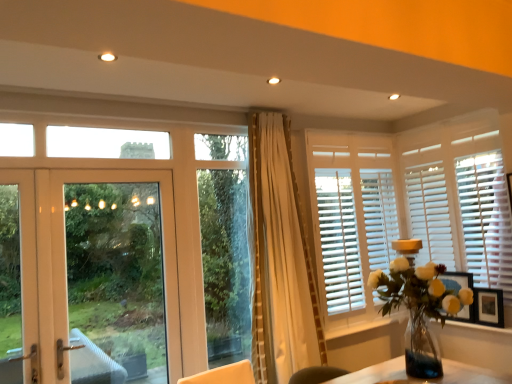
Question: Can you confirm if translucent glass vase at right is taller than wooden picture frame at right?

Choices:
 (A) no
 (B) yes

Answer: (B)

Question: Are translucent glass vase at right and wooden picture frame at right beside each other?

Choices:
 (A) yes
 (B) no

Answer: (B)

Question: Could you tell me if translucent glass vase at right is turned towards wooden picture frame at right?

Choices:
 (A) yes
 (B) no

Answer: (B)

Question: Is translucent glass vase at right oriented away from wooden picture frame at right?

Choices:
 (A) no
 (B) yes

Answer: (B)

Question: Would you say translucent glass vase at right is a long distance from wooden picture frame at right?

Choices:
 (A) no
 (B) yes

Answer: (A)

Question: Is white wood window sill at lower right in front of or behind white wood door at left in the image?

Choices:
 (A) front
 (B) behind

Answer: (B)

Question: From the image's perspective, is white wood window sill at lower right positioned above or below white wood door at left?

Choices:
 (A) above
 (B) below

Answer: (B)

Question: Considering the relative positions of white wood window sill at lower right and white wood door at left in the image provided, is white wood window sill at lower right to the left or to the right of white wood door at left?

Choices:
 (A) right
 (B) left

Answer: (A)

Question: Is point (362, 327) positioned closer to the camera than point (53, 362)?

Choices:
 (A) closer
 (B) farther

Answer: (B)

Question: Would you say white wood blinds at right is to the left or to the right of white wooden blinds at upper right in the picture?

Choices:
 (A) right
 (B) left

Answer: (A)

Question: In the image, is white wood blinds at right positioned in front of or behind white wooden blinds at upper right?

Choices:
 (A) front
 (B) behind

Answer: (A)

Question: Is point (330, 266) positioned closer to the camera than point (352, 175)?

Choices:
 (A) farther
 (B) closer

Answer: (B)

Question: Is white wood blinds at right inside the boundaries of white wooden blinds at upper right, or outside?

Choices:
 (A) inside
 (B) outside

Answer: (B)

Question: Is white wood door at left taller or shorter than translucent glass vase at right?

Choices:
 (A) short
 (B) tall

Answer: (B)

Question: Relative to translucent glass vase at right, is white wood door at left in front or behind?

Choices:
 (A) behind
 (B) front

Answer: (A)